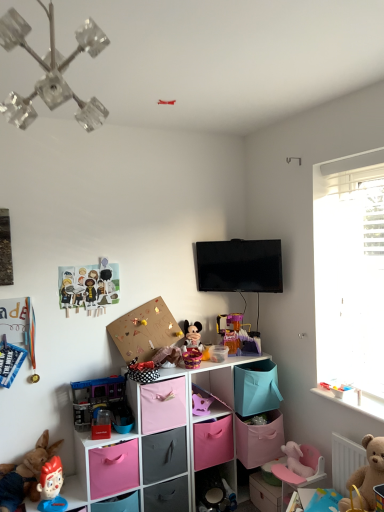
The width and height of the screenshot is (384, 512). I want to click on free space to the left of wooden toy at upper center, the 1th toy from the top, so click(x=126, y=101).